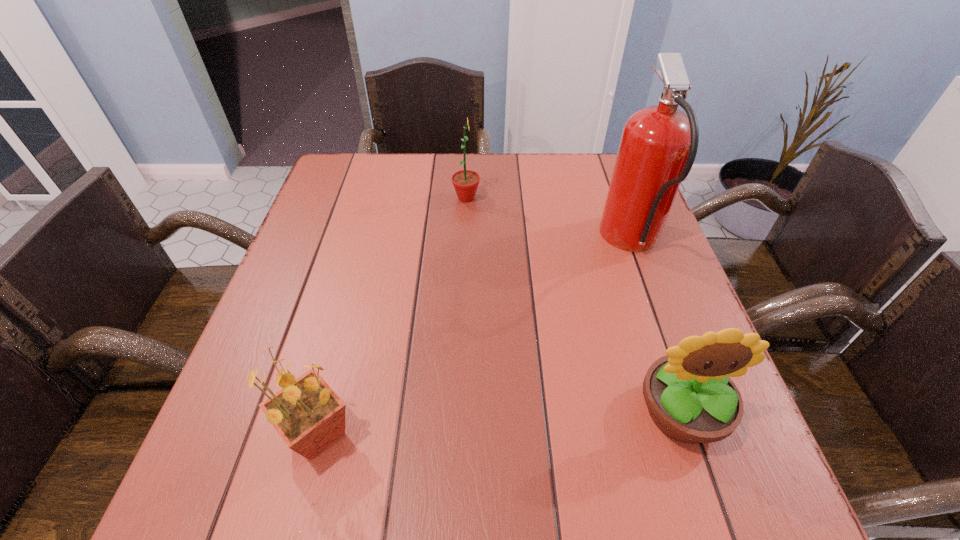
The height and width of the screenshot is (540, 960). Find the location of `vacant area located on the face of the second object from left to right`. vacant area located on the face of the second object from left to right is located at coordinates (539, 198).

What are the coordinates of `object that is at the far edge` in the screenshot? It's located at (465, 182).

Where is `object positioned at the near edge`? The width and height of the screenshot is (960, 540). object positioned at the near edge is located at coordinates (308, 415).

The width and height of the screenshot is (960, 540). I want to click on object that is at the left edge, so click(x=308, y=415).

Locate an element on the screen. This screenshot has width=960, height=540. fire extinguisher that is at the right edge is located at coordinates (658, 146).

At what (x,y) coordinates should I click in order to perform the action: click on sunflower that is at the right edge. Please return your answer as a coordinate pair (x, y). Looking at the image, I should click on (690, 397).

Where is `object positioned at the near left corner`? object positioned at the near left corner is located at coordinates (308, 415).

At what (x,y) coordinates should I click in order to perform the action: click on free space at the far edge. Please return your answer as a coordinate pair (x, y). The height and width of the screenshot is (540, 960). Looking at the image, I should click on [x=495, y=179].

Identify the location of vacant position at the near edge of the desktop. The width and height of the screenshot is (960, 540). (457, 481).

I want to click on vacant area at the left edge, so click(336, 272).